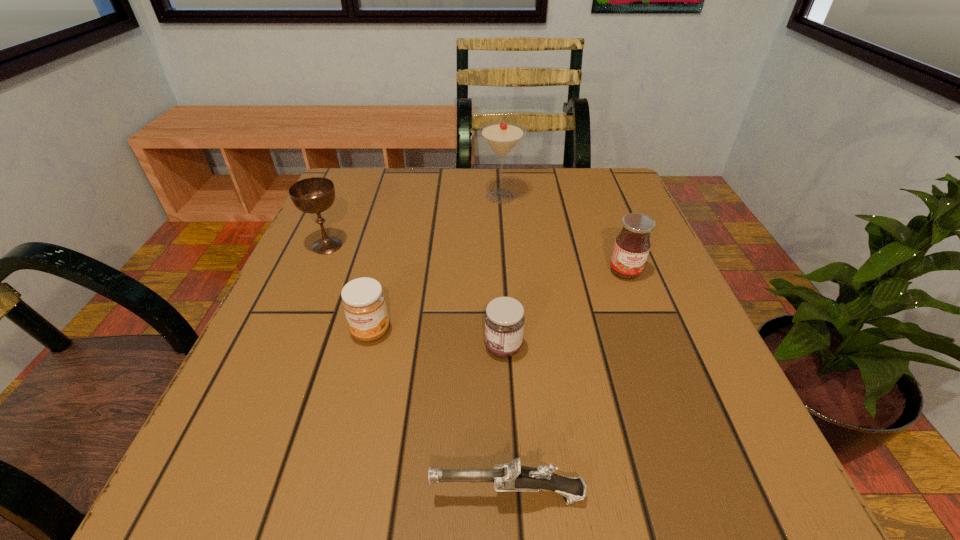
Locate an element on the screen. This screenshot has height=540, width=960. vacant space located on the back of the leftmost object is located at coordinates (352, 187).

Locate an element on the screen. Image resolution: width=960 pixels, height=540 pixels. free space located on the label side of the rightmost object is located at coordinates (681, 415).

Locate an element on the screen. The height and width of the screenshot is (540, 960). vacant space located on the front label of the second object from left to right is located at coordinates (359, 377).

This screenshot has width=960, height=540. Identify the location of vacant region located 0.140m on the front label of the second jam from left to right. (397, 347).

What are the coordinates of `free location located on the front label of the second jam from left to right` in the screenshot? It's located at (311, 347).

At what (x,y) coordinates should I click in order to perform the action: click on free location located on the front label of the second jam from left to right. Please return your answer as a coordinate pair (x, y). This screenshot has height=540, width=960. Looking at the image, I should click on (360, 347).

At what (x,y) coordinates should I click in order to perform the action: click on vacant region located 0.120m aimed along the barrel of the gun. Please return your answer as a coordinate pair (x, y). This screenshot has width=960, height=540. Looking at the image, I should click on (333, 495).

Image resolution: width=960 pixels, height=540 pixels. Find the location of `vacant region located aimed along the barrel of the gun`. vacant region located aimed along the barrel of the gun is located at coordinates (309, 495).

Find the location of a particular element. vacant region located aimed along the barrel of the gun is located at coordinates (178, 495).

This screenshot has width=960, height=540. Find the location of `object present at the far edge`. object present at the far edge is located at coordinates (501, 136).